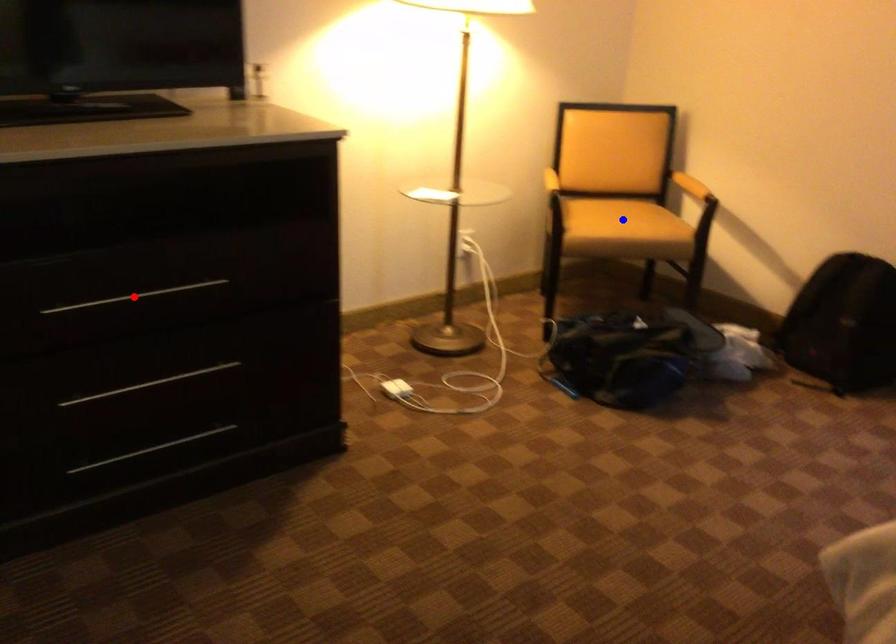
Question: Two points are marked on the image. Which point is closer to the camera?

Choices:
 (A) Blue point is closer.
 (B) Red point is closer.

Answer: (B)